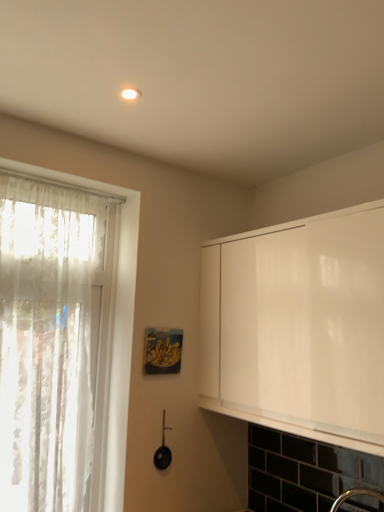
Question: From the image's perspective, is white matte cabinet at right under white lace curtain at left?

Choices:
 (A) yes
 (B) no

Answer: (B)

Question: Considering the relative sizes of white matte cabinet at right and white lace curtain at left in the image provided, is white matte cabinet at right bigger than white lace curtain at left?

Choices:
 (A) yes
 (B) no

Answer: (A)

Question: Is white matte cabinet at right directly adjacent to white lace curtain at left?

Choices:
 (A) no
 (B) yes

Answer: (A)

Question: Is white matte cabinet at right behind white lace curtain at left?

Choices:
 (A) no
 (B) yes

Answer: (A)

Question: From the image's perspective, is white matte cabinet at right over white lace curtain at left?

Choices:
 (A) no
 (B) yes

Answer: (B)

Question: Does point (357, 265) appear closer or farther from the camera than point (62, 257)?

Choices:
 (A) farther
 (B) closer

Answer: (B)

Question: In terms of size, does white matte cabinet at right appear bigger or smaller than white lace curtain at left?

Choices:
 (A) big
 (B) small

Answer: (A)

Question: Visually, is white matte cabinet at right positioned to the left or to the right of white lace curtain at left?

Choices:
 (A) right
 (B) left

Answer: (A)

Question: Considering their positions, is white matte cabinet at right located in front of or behind white lace curtain at left?

Choices:
 (A) front
 (B) behind

Answer: (A)

Question: Is point (56, 197) positioned closer to the camera than point (150, 371)?

Choices:
 (A) closer
 (B) farther

Answer: (A)

Question: In terms of width, does white lace curtain at left look wider or thinner when compared to matte wooden picture frame at center?

Choices:
 (A) thin
 (B) wide

Answer: (B)

Question: From the image's perspective, is white lace curtain at left positioned above or below matte wooden picture frame at center?

Choices:
 (A) above
 (B) below

Answer: (A)

Question: Visually, is white lace curtain at left positioned to the left or to the right of matte wooden picture frame at center?

Choices:
 (A) right
 (B) left

Answer: (B)

Question: Considering the positions of white lace curtain at left and white matte cabinet at right in the image, is white lace curtain at left taller or shorter than white matte cabinet at right?

Choices:
 (A) short
 (B) tall

Answer: (B)

Question: Considering the positions of white lace curtain at left and white matte cabinet at right in the image, is white lace curtain at left wider or thinner than white matte cabinet at right?

Choices:
 (A) wide
 (B) thin

Answer: (B)